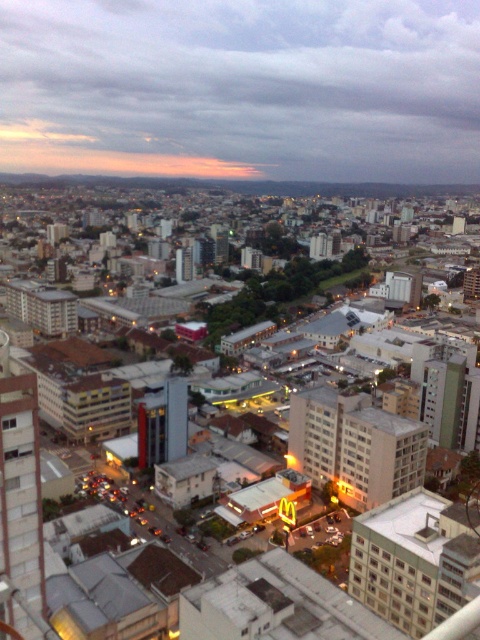
Question: Which object is closer to the camera taking this photo?

Choices:
 (A) matte concrete buildings at center
 (B) cloudy sky at upper center

Answer: (A)

Question: Can you confirm if cloudy sky at upper center is wider than matte concrete buildings at center?

Choices:
 (A) no
 (B) yes

Answer: (B)

Question: Can you confirm if cloudy sky at upper center is positioned to the left of matte concrete buildings at center?

Choices:
 (A) no
 (B) yes

Answer: (B)

Question: Can you confirm if cloudy sky at upper center is smaller than matte concrete buildings at center?

Choices:
 (A) no
 (B) yes

Answer: (B)